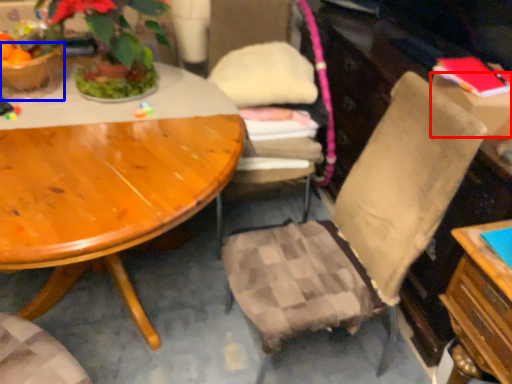
Question: Which point is closer to the camera, box (highlighted by a red box) or flowerpot (highlighted by a blue box)?

Choices:
 (A) box
 (B) flowerpot

Answer: (A)